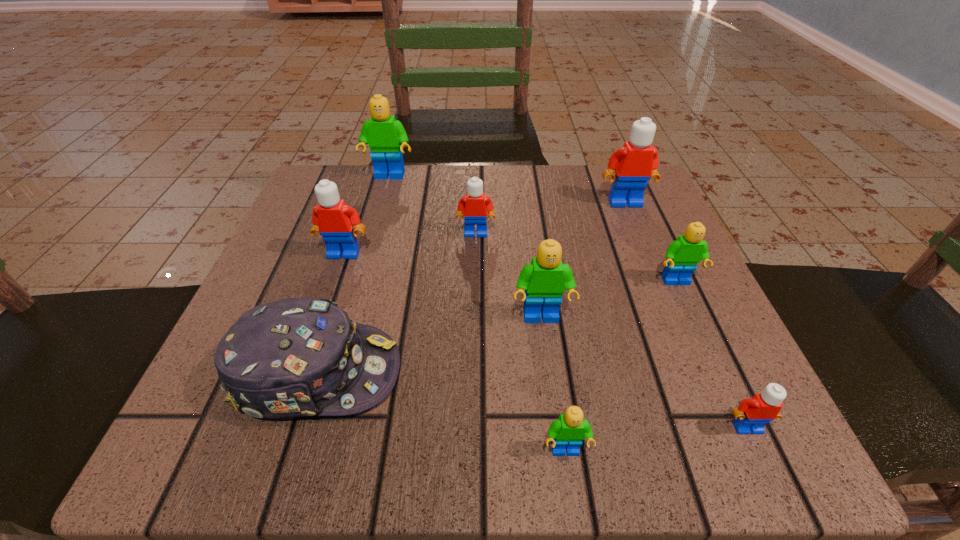
This screenshot has width=960, height=540. I want to click on vacant area situated on the face of the second nearest green Lego, so click(x=557, y=435).

You are a GUI agent. You are given a task and a screenshot of the screen. Output one action in this format:
    pyautogui.click(x=<x>, y=<y>)
    Task: Click on the vacant space situated on the face of the second farthest white Lego
    This screenshot has width=960, height=540.
    Given the screenshot: What is the action you would take?
    pyautogui.click(x=474, y=318)

I want to click on free space located 0.110m on the face of the fifth farthest Lego, so click(x=704, y=342).

This screenshot has height=540, width=960. I want to click on vacant position located 0.150m on the front-facing side of the headwear, so pyautogui.click(x=507, y=373).

Where is `headwear present at the near edge`? headwear present at the near edge is located at coordinates (299, 357).

The width and height of the screenshot is (960, 540). Find the location of `headwear at the left edge`. headwear at the left edge is located at coordinates tap(299, 357).

You are a GUI agent. You are given a task and a screenshot of the screen. Output one action in this format:
    pyautogui.click(x=<x>, y=<y>)
    Task: Click on the object present at the far left corner
    This screenshot has width=960, height=540.
    Given the screenshot: What is the action you would take?
    [383, 133]

Identify the location of object positioned at the near left corner. The height and width of the screenshot is (540, 960). (299, 357).

You are a GUI agent. You are given a task and a screenshot of the screen. Output one action in this format:
    pyautogui.click(x=<x>, y=<y>)
    Task: Click on the object that is positioned at the far right corner
    This screenshot has height=540, width=960.
    Given the screenshot: What is the action you would take?
    pyautogui.click(x=635, y=163)

Locate an element on the screen. object at the near right corner is located at coordinates (752, 415).